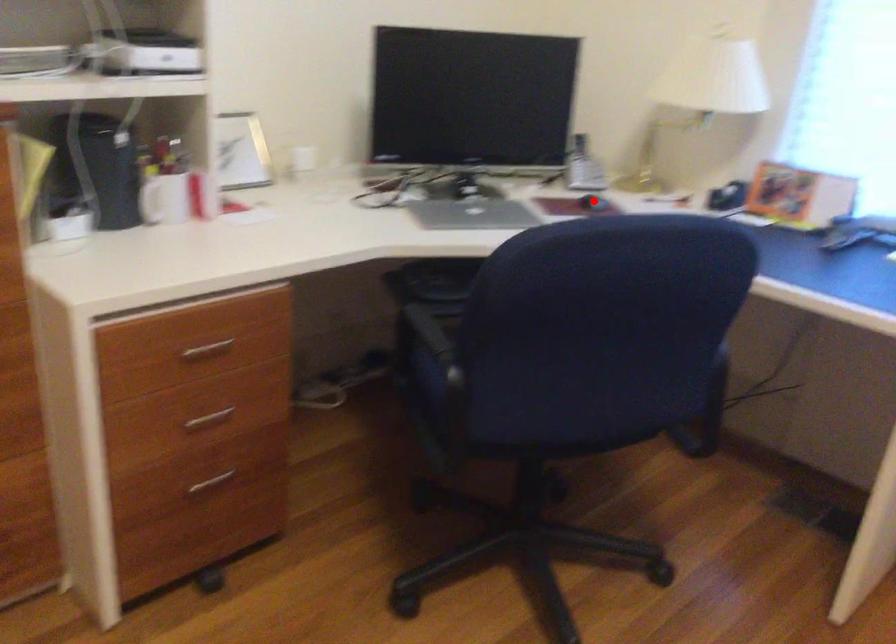
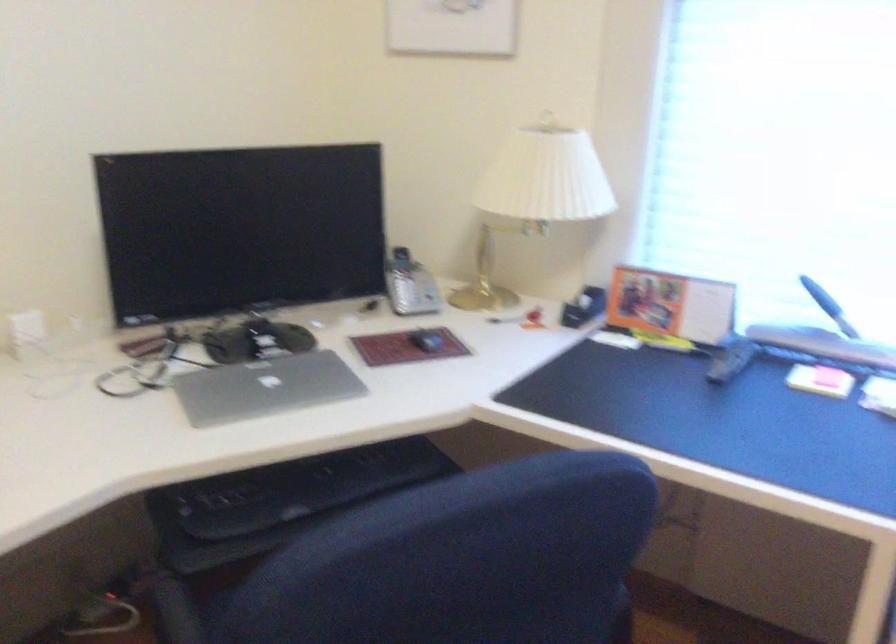
Question: I am providing you with two images of the same scene from different viewpoints. Given a red point in image1, look at the same physical point in image2. Is it:

Choices:
 (A) Closer to the viewpoint
 (B) Farther from the viewpoint

Answer: (A)